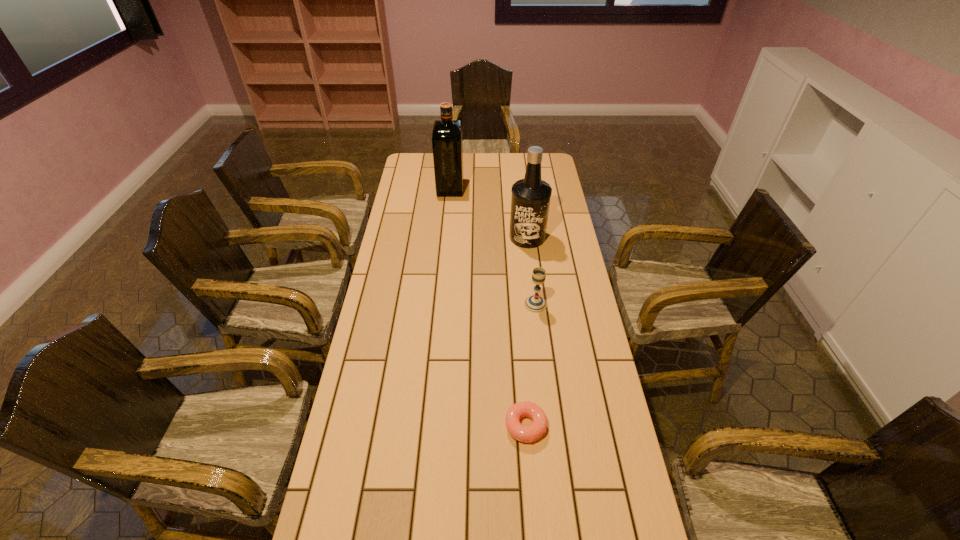
Image resolution: width=960 pixels, height=540 pixels. Find the location of `free space between the doughnut and the right liquor`. free space between the doughnut and the right liquor is located at coordinates (526, 332).

This screenshot has height=540, width=960. In order to click on free spot between the chalice and the nearest object in this screenshot , I will do `click(531, 365)`.

Where is `vacant point located between the second nearest object and the second farthest object`? The height and width of the screenshot is (540, 960). vacant point located between the second nearest object and the second farthest object is located at coordinates point(532,271).

Where is `vacant area that lies between the nearer liquor and the farther liquor`? This screenshot has height=540, width=960. vacant area that lies between the nearer liquor and the farther liquor is located at coordinates [x=489, y=212].

I want to click on empty location between the nearest object and the left liquor, so pos(488,307).

I want to click on vacant area that lies between the nearest object and the left liquor, so click(x=488, y=307).

Where is `blank region between the nearest object and the second nearest object`? The width and height of the screenshot is (960, 540). blank region between the nearest object and the second nearest object is located at coordinates (531, 365).

The height and width of the screenshot is (540, 960). I want to click on object that is the third closest to the shortest object, so click(447, 144).

Identify which object is located as the second nearest to the chalice. Please provide its 2D coordinates. Your answer should be formatted as a tuple, i.e. [(x, y)], where the tuple contains the x and y coordinates of a point satisfying the conditions above.

[(533, 432)]

The height and width of the screenshot is (540, 960). What are the coordinates of `free location that satisfies the following two spatial constraints: 1. on the front label of the doughnut; 2. on the right side of the farther liquor` in the screenshot? It's located at (429, 426).